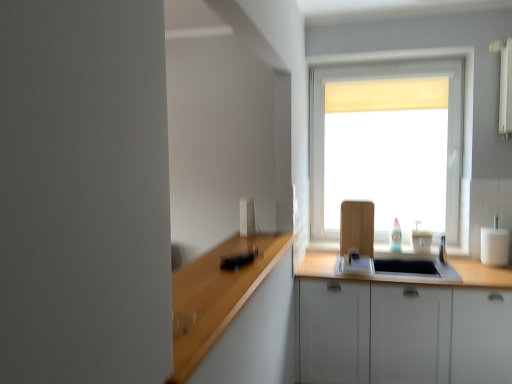
What do you see at coordinates (495, 245) in the screenshot? This screenshot has width=512, height=384. I see `white glossy cup at right, arranged as the first appliance when viewed from the right` at bounding box center [495, 245].

The height and width of the screenshot is (384, 512). What do you see at coordinates (460, 107) in the screenshot? I see `white matte window at center` at bounding box center [460, 107].

What do you see at coordinates (247, 217) in the screenshot? The width and height of the screenshot is (512, 384). I see `white glossy toaster at upper center, marked as the second appliance in a back-to-front arrangement` at bounding box center [247, 217].

Locate an element on the screen. white glossy sink at center is located at coordinates (398, 268).

Is white glossy toaster at upper center, which is counted as the second appliance, starting from the right, facing away from white glossy cup at right, the first appliance viewed from the back?

No, white glossy toaster at upper center, which is counted as the second appliance, starting from the right, is not facing the opposite direction of white glossy cup at right, the first appliance viewed from the back.

Can you confirm if white glossy toaster at upper center, marked as the second appliance in a back-to-front arrangement, is taller than white glossy cup at right, which is the second appliance in front-to-back order?

In fact, white glossy toaster at upper center, marked as the second appliance in a back-to-front arrangement, may be shorter than white glossy cup at right, which is the second appliance in front-to-back order.

Is white glossy toaster at upper center, marked as the second appliance in a back-to-front arrangement, outside of white glossy cup at right, the 2th appliance from the left?

Yes, white glossy toaster at upper center, marked as the second appliance in a back-to-front arrangement, is not within white glossy cup at right, the 2th appliance from the left.

Is white glossy toaster at upper center, which is counted as the second appliance, starting from the right, positioned far away from white glossy cup at right, which is the second appliance in front-to-back order?

white glossy toaster at upper center, which is counted as the second appliance, starting from the right, is positioned a significant distance from white glossy cup at right, which is the second appliance in front-to-back order.

Consider the image. Considering the sizes of white glossy cup at right, the 2th appliance from the left, and white glossy toaster at upper center, placed as the 1th appliance when sorted from left to right, in the image, is white glossy cup at right, the 2th appliance from the left, bigger or smaller than white glossy toaster at upper center, placed as the 1th appliance when sorted from left to right,?

Considering their sizes, white glossy cup at right, the 2th appliance from the left, takes up more space than white glossy toaster at upper center, placed as the 1th appliance when sorted from left to right.

Is white glossy cup at right, the 2th appliance from the left, completely or partially outside of white glossy toaster at upper center, marked as the second appliance in a back-to-front arrangement?

That's correct, white glossy cup at right, the 2th appliance from the left, is outside of white glossy toaster at upper center, marked as the second appliance in a back-to-front arrangement.

Who is more distant, white glossy cup at right, the first appliance viewed from the back, or white glossy toaster at upper center, marked as the second appliance in a back-to-front arrangement?

white glossy cup at right, the first appliance viewed from the back.

From a real-world perspective, relative to white glossy sink at center, is white glossy toaster at upper center, marked as the second appliance in a back-to-front arrangement, vertically above or below?

Clearly, from a real-world perspective, white glossy toaster at upper center, marked as the second appliance in a back-to-front arrangement, is above white glossy sink at center.

Which point is more forward, (x=251, y=201) or (x=424, y=259)?

The point (x=251, y=201) is in front.

From the image's perspective, is white glossy toaster at upper center, placed as the 1th appliance when sorted from left to right, positioned above or below white glossy sink at center?

Based on their image positions, white glossy toaster at upper center, placed as the 1th appliance when sorted from left to right, is located above white glossy sink at center.

You are a GUI agent. You are given a task and a screenshot of the screen. Output one action in this format:
    pyautogui.click(x=<x>, y=<y>)
    Task: Click on the appliance that is on the left side of white glossy sink at center
    This screenshot has height=384, width=512.
    Given the screenshot: What is the action you would take?
    pyautogui.click(x=247, y=217)

Is white glossy cup at right, which is the second appliance in front-to-back order, facing towards white glossy sink at center?

No, white glossy cup at right, which is the second appliance in front-to-back order, does not turn towards white glossy sink at center.

Looking at the image, does white glossy cup at right, which is the second appliance in front-to-back order, seem bigger or smaller compared to white glossy sink at center?

A: Considering their sizes, white glossy cup at right, which is the second appliance in front-to-back order, takes up less space than white glossy sink at center.

Between white glossy cup at right, arranged as the first appliance when viewed from the right, and white glossy sink at center, which one appears on the right side from the viewer's perspective?

Positioned to the right is white glossy cup at right, arranged as the first appliance when viewed from the right.

From a real-world perspective, which is physically below, white glossy cup at right, arranged as the first appliance when viewed from the right, or white glossy sink at center?

white glossy sink at center, from a real-world perspective.

Considering the positions of objects white matte cabinet at lower right and white matte window at center in the image provided, who is more to the left, white matte cabinet at lower right or white matte window at center?

white matte window at center.

Who is more distant, white matte cabinet at lower right or white matte window at center?

white matte window at center.

Would you say white matte cabinet at lower right is inside or outside white matte window at center?

white matte cabinet at lower right is not inside white matte window at center, it's outside.

Which of these two, white glossy sink at center or white matte cabinet at lower right, is smaller?

Smaller between the two is white glossy sink at center.

Can white matte cabinet at lower right be found inside white glossy sink at center?

No, white matte cabinet at lower right is located outside of white glossy sink at center.

In order to click on cabinetry beneath the white glossy sink at center (from a real-world perspective) in this screenshot , I will do `click(404, 327)`.

Are white glossy sink at center and white matte cabinet at lower right located far from each other?

No, white glossy sink at center is not far from white matte cabinet at lower right.

Visually, is white matte cabinet at lower right positioned to the left or to the right of white glossy cup at right, arranged as the first appliance when viewed from the right?

white matte cabinet at lower right is positioned on white glossy cup at right, arranged as the first appliance when viewed from the right,'s left side.

Considering the sizes of white matte cabinet at lower right and white glossy cup at right, which is the second appliance in front-to-back order, in the image, is white matte cabinet at lower right taller or shorter than white glossy cup at right, which is the second appliance in front-to-back order,?

Considering their sizes, white matte cabinet at lower right has more height than white glossy cup at right, which is the second appliance in front-to-back order.

Is white matte cabinet at lower right with white glossy cup at right, the 2th appliance from the left?

No, white matte cabinet at lower right is not making contact with white glossy cup at right, the 2th appliance from the left.

From the image's perspective, between white matte cabinet at lower right and white glossy cup at right, which is the second appliance in front-to-back order, which one is located above?

white glossy cup at right, which is the second appliance in front-to-back order.

Where is `appliance below the white glossy toaster at upper center, which is counted as the second appliance, starting from the right (from the image's perspective)`? appliance below the white glossy toaster at upper center, which is counted as the second appliance, starting from the right (from the image's perspective) is located at coordinates (495, 245).

The width and height of the screenshot is (512, 384). What are the coordinates of `appliance located behind the white glossy toaster at upper center, marked as the second appliance in a back-to-front arrangement` in the screenshot? It's located at (495, 245).

Based on their spatial positions, is white matte window at center or white matte cabinet at lower right closer to white glossy toaster at upper center, placed as the 1th appliance when sorted from left to right?

Among the two, white matte cabinet at lower right is located nearer to white glossy toaster at upper center, placed as the 1th appliance when sorted from left to right.

Which object lies nearer to the anchor point white matte cabinet at lower right, white matte window at center or white glossy cup at right, the first appliance viewed from the back?

Based on the image, white glossy cup at right, the first appliance viewed from the back, appears to be nearer to white matte cabinet at lower right.

Estimate the real-world distances between objects in this image. Which object is further from white matte cabinet at lower right, white glossy toaster at upper center, which is counted as the second appliance, starting from the right, or white glossy cup at right, the 2th appliance from the left?

white glossy toaster at upper center, which is counted as the second appliance, starting from the right, is further to white matte cabinet at lower right.

From the image, which object appears to be nearer to white matte window at center, white glossy sink at center or white matte cabinet at lower right?

white glossy sink at center is closer to white matte window at center.

Looking at the image, which one is located further to white glossy sink at center, white matte window at center or white glossy toaster at upper center, placed as the 1th appliance when sorted from left to right?

The object further to white glossy sink at center is white glossy toaster at upper center, placed as the 1th appliance when sorted from left to right.

When comparing their distances from white glossy toaster at upper center, which is counted as the second appliance, starting from the right, does white matte window at center or white glossy cup at right, which is the second appliance in front-to-back order, seem further?

white glossy cup at right, which is the second appliance in front-to-back order, is further to white glossy toaster at upper center, which is counted as the second appliance, starting from the right.

From the image, which object appears to be farther from white glossy toaster at upper center, which is counted as the second appliance, starting from the right, white matte cabinet at lower right or white glossy cup at right, the 2th appliance from the left?

Among the two, white glossy cup at right, the 2th appliance from the left, is located further to white glossy toaster at upper center, which is counted as the second appliance, starting from the right.

Estimate the real-world distances between objects in this image. Which object is closer to white matte cabinet at lower right, white glossy sink at center or white glossy cup at right, the 2th appliance from the left?

white glossy sink at center.

Image resolution: width=512 pixels, height=384 pixels. I want to click on sink located between white glossy toaster at upper center, marked as the second appliance in a back-to-front arrangement, and white matte window at center in the left-right direction, so click(x=398, y=268).

The width and height of the screenshot is (512, 384). Find the location of `sink situated between white glossy toaster at upper center, marked as the second appliance in a back-to-front arrangement, and white matte cabinet at lower right from left to right`. sink situated between white glossy toaster at upper center, marked as the second appliance in a back-to-front arrangement, and white matte cabinet at lower right from left to right is located at coordinates (398, 268).

This screenshot has width=512, height=384. Find the location of `cabinetry between white glossy sink at center and white glossy cup at right, the first appliance viewed from the back, in the horizontal direction`. cabinetry between white glossy sink at center and white glossy cup at right, the first appliance viewed from the back, in the horizontal direction is located at coordinates (404, 327).

Where is `sink situated between white glossy toaster at upper center, marked as the second appliance in a back-to-front arrangement, and white glossy cup at right, the first appliance viewed from the back, from left to right`? sink situated between white glossy toaster at upper center, marked as the second appliance in a back-to-front arrangement, and white glossy cup at right, the first appliance viewed from the back, from left to right is located at coordinates (398, 268).